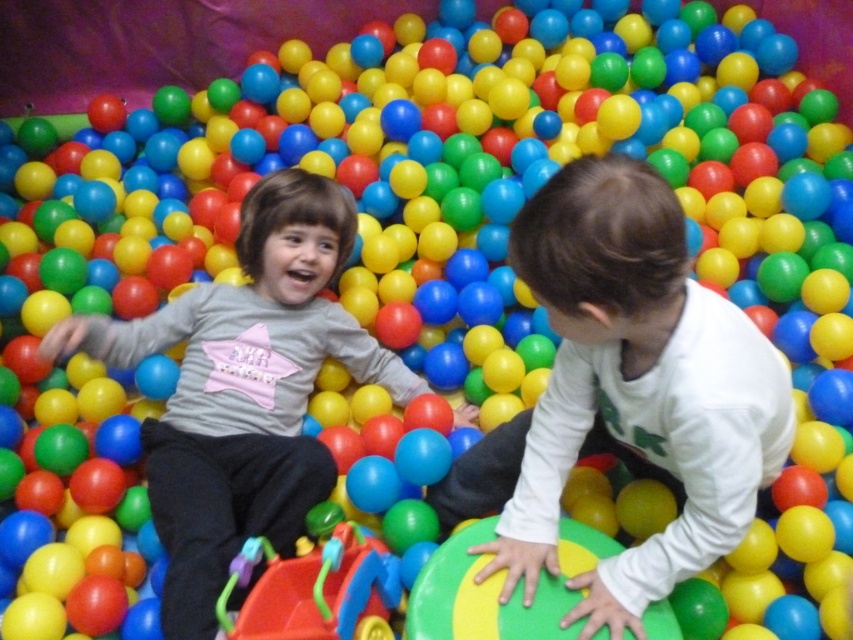
Question: Does white matte shirt at center appear under matte gray shirt at center?

Choices:
 (A) no
 (B) yes

Answer: (B)

Question: Which object is closer to the camera taking this photo?

Choices:
 (A) matte gray shirt at center
 (B) white matte shirt at center

Answer: (B)

Question: Which point appears farthest from the camera in this image?

Choices:
 (A) (207, 372)
 (B) (538, 515)

Answer: (A)

Question: Does white matte shirt at center appear on the left side of matte gray shirt at center?

Choices:
 (A) no
 (B) yes

Answer: (A)

Question: Can you confirm if white matte shirt at center is positioned above matte gray shirt at center?

Choices:
 (A) yes
 (B) no

Answer: (B)